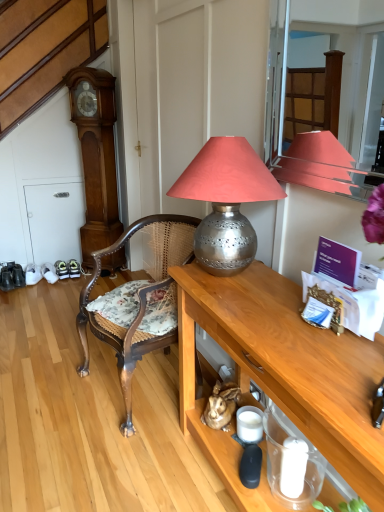
Where is `free space to the left of woven cane chair at center`? Image resolution: width=384 pixels, height=512 pixels. free space to the left of woven cane chair at center is located at coordinates (44, 389).